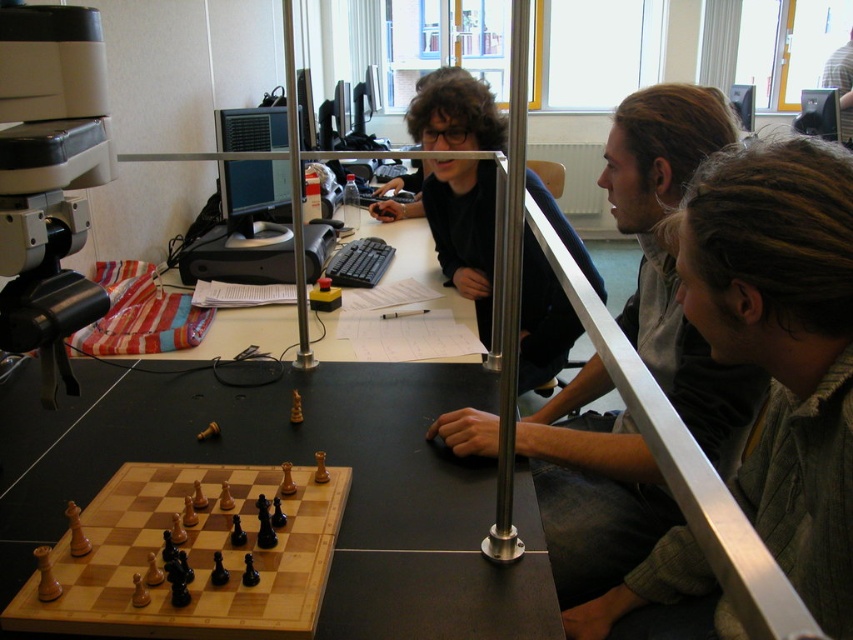
Between dark brown hair at center and light brown wood chessboard at lower left, which one appears on the right side from the viewer's perspective?

Positioned to the right is dark brown hair at center.

Who is higher up, dark brown hair at center or light brown wood chessboard at lower left?

dark brown hair at center is higher up.

Does point (712, 417) lie in front of point (165, 470)?

No, it is behind (165, 470).

Identify the location of dark brown hair at center. (672, 260).

Who is shorter, brown hair at center or dark brown hair at center?

brown hair at center

Does brown hair at center have a greater height compared to dark brown hair at center?

Incorrect, brown hair at center's height is not larger of dark brown hair at center's.

Between point (697, 237) and point (604, 557), which one is positioned behind?

Point (604, 557)

The height and width of the screenshot is (640, 853). Find the location of `brown hair at center`. brown hair at center is located at coordinates (782, 342).

Can you confirm if brown hair at center is positioned above matte black shirt at upper center?

Actually, brown hair at center is below matte black shirt at upper center.

Consider the image. Can you confirm if brown hair at center is positioned below matte black shirt at upper center?

Yes.

You are a GUI agent. You are given a task and a screenshot of the screen. Output one action in this format:
    pyautogui.click(x=<x>, y=<y>)
    Task: Click on the brown hair at center
    This screenshot has height=640, width=853.
    Given the screenshot: What is the action you would take?
    point(782,342)